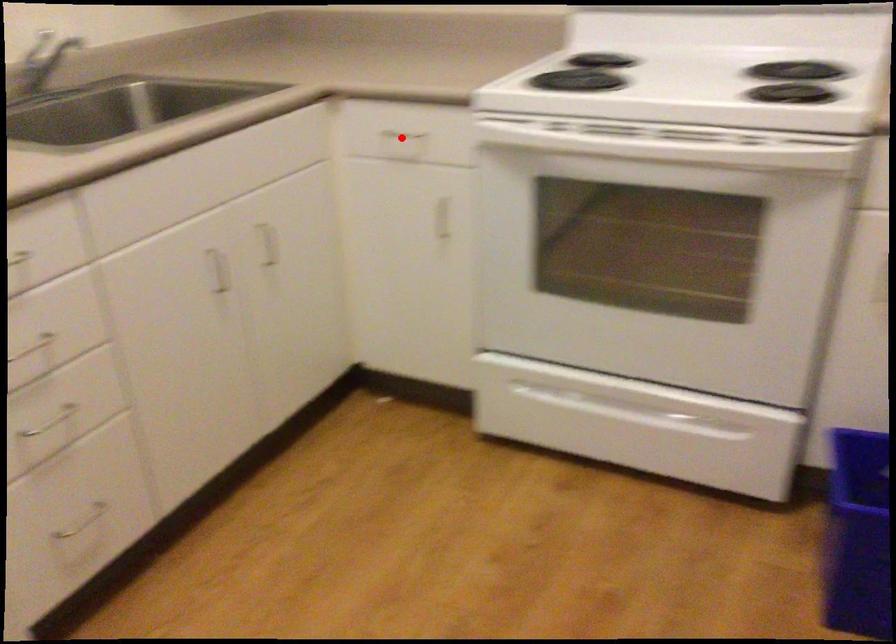
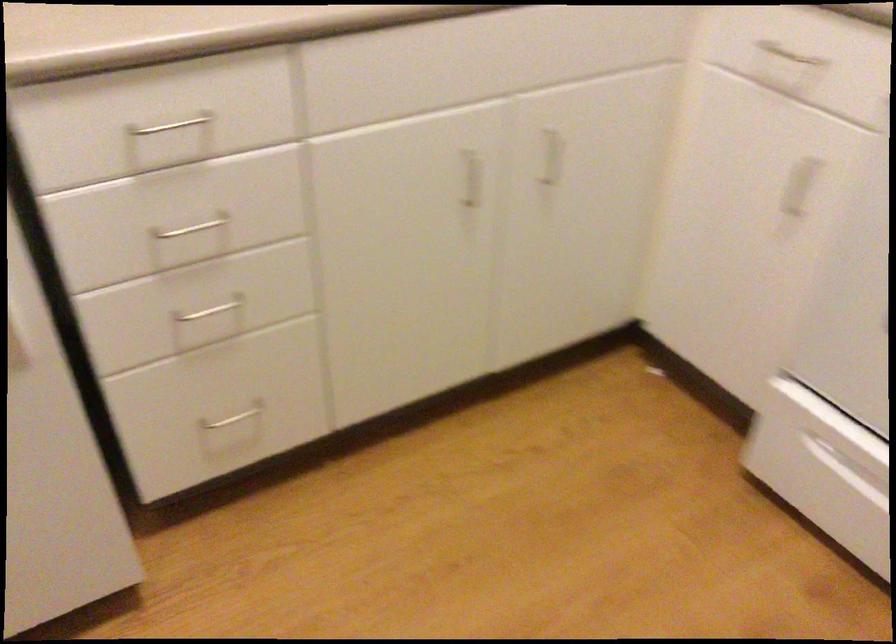
Question: I am providing you with two images of the same scene from different viewpoints. A red point is shown in image1. For the corresponding object point in image2, is it positioned nearer or farther from the camera?

Choices:
 (A) Nearer
 (B) Farther

Answer: (A)